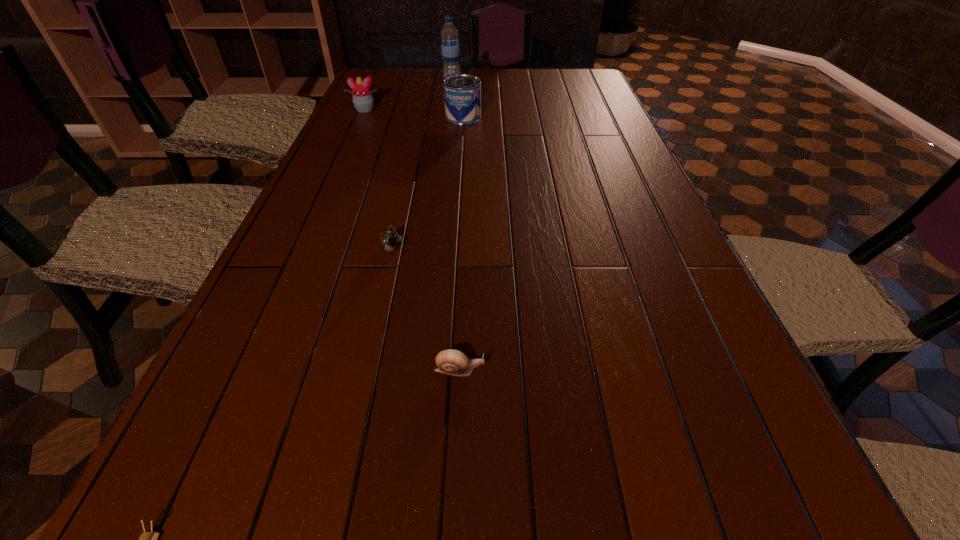
Identify the location of the farthest object. (450, 50).

Where is `water bottle`? This screenshot has height=540, width=960. water bottle is located at coordinates (450, 50).

Where is `can`? Image resolution: width=960 pixels, height=540 pixels. can is located at coordinates point(462,92).

Identify the location of cupcake. (363, 100).

Find the location of `the tallest escargot`. the tallest escargot is located at coordinates (390, 238).

I want to click on the second escargot from right to left, so click(x=390, y=238).

Identify the location of the rightmost escargot. Image resolution: width=960 pixels, height=540 pixels. (452, 362).

At what (x,y) coordinates should I click in order to perform the action: click on the second farthest escargot. Please return your answer as a coordinate pair (x, y). This screenshot has width=960, height=540. Looking at the image, I should click on click(x=452, y=362).

You are a GUI agent. You are given a task and a screenshot of the screen. Output one action in this format:
    pyautogui.click(x=<x>, y=<y>)
    Task: Click on the blank area located 0.080m on the label of the water bottle
    The image size is (960, 540).
    Given the screenshot: What is the action you would take?
    pyautogui.click(x=482, y=80)

At what (x,y) coordinates should I click in order to perform the action: click on free location located 0.390m on the front label of the can. Please return your answer as a coordinate pair (x, y). Looking at the image, I should click on click(597, 117).